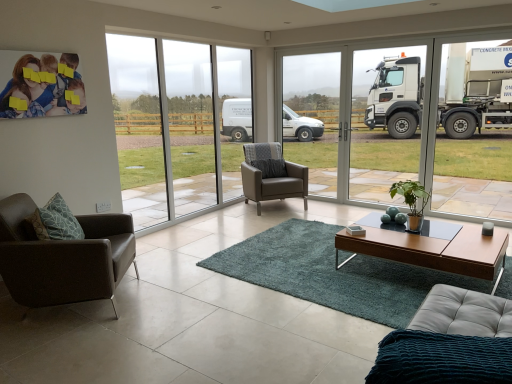
Locate an element on the screen. This screenshot has height=384, width=512. free location in front of transparent glass window at center is located at coordinates (192, 236).